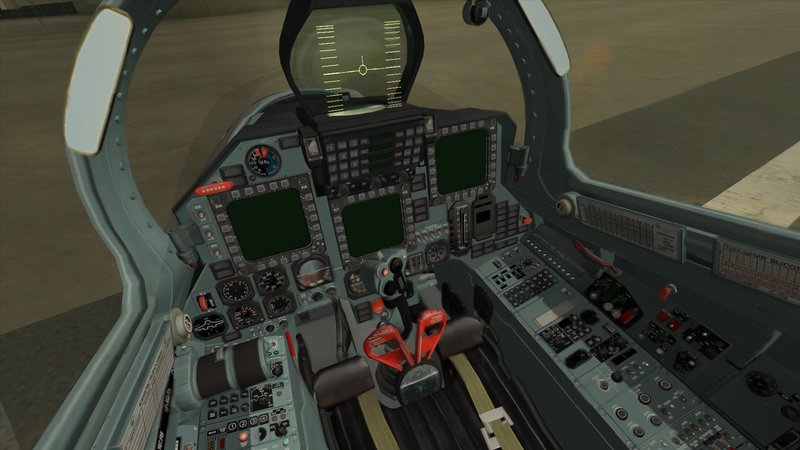
I want to click on display screens, so click(x=270, y=222), click(x=372, y=231), click(x=465, y=162).